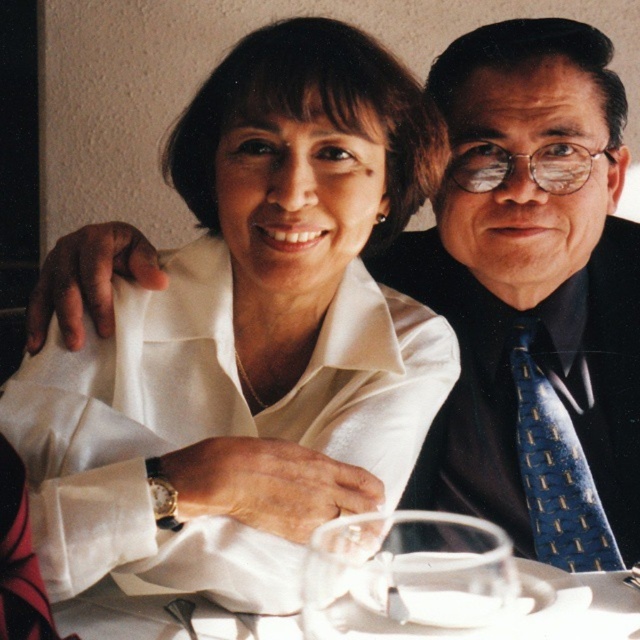
Question: Does satin white blouse at center have a smaller size compared to clear glass wine glass at center?

Choices:
 (A) yes
 (B) no

Answer: (B)

Question: Which is nearer to the clear glass wine glass at center?

Choices:
 (A) blue textured tie at right
 (B) white glossy plate at center
 (C) blue textured tie at center

Answer: (B)

Question: Which of the following is the closest to the observer?

Choices:
 (A) (218, 637)
 (B) (397, 589)

Answer: (A)

Question: Which object is farther from the camera taking this photo?

Choices:
 (A) blue textured tie at center
 (B) satin white blouse at center
 (C) blue textured tie at right
 (D) white glossy plate at center

Answer: (A)

Question: From the image, what is the correct spatial relationship of white glossy plate at center in relation to blue textured tie at right?

Choices:
 (A) left
 (B) right

Answer: (A)

Question: In this image, where is clear glass wine glass at center located relative to blue textured tie at right?

Choices:
 (A) left
 (B) right

Answer: (A)